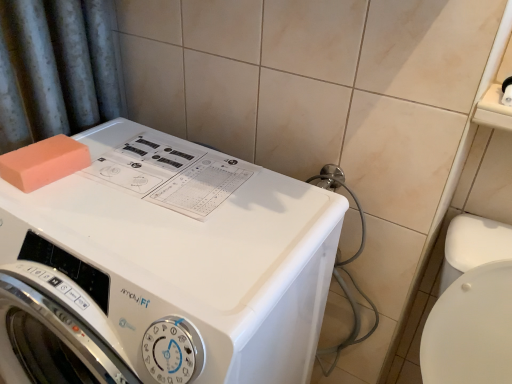
Question: From a real-world perspective, is orange matte sponge at top left located beneath white glossy washing machine at center?

Choices:
 (A) yes
 (B) no

Answer: (B)

Question: From the image's perspective, is orange matte sponge at top left beneath white glossy washing machine at center?

Choices:
 (A) no
 (B) yes

Answer: (A)

Question: From a real-world perspective, is orange matte sponge at top left on top of white glossy washing machine at center?

Choices:
 (A) no
 (B) yes

Answer: (B)

Question: Does orange matte sponge at top left have a lesser height compared to white glossy washing machine at center?

Choices:
 (A) yes
 (B) no

Answer: (A)

Question: Is orange matte sponge at top left with white glossy washing machine at center?

Choices:
 (A) no
 (B) yes

Answer: (A)

Question: Considering the relative sizes of orange matte sponge at top left and white glossy washing machine at center in the image provided, is orange matte sponge at top left smaller than white glossy washing machine at center?

Choices:
 (A) yes
 (B) no

Answer: (A)

Question: Is white glossy washing machine at center oriented towards orange matte sponge at top left?

Choices:
 (A) yes
 (B) no

Answer: (B)

Question: Does white glossy washing machine at center have a lesser width compared to orange matte sponge at top left?

Choices:
 (A) no
 (B) yes

Answer: (A)

Question: Is orange matte sponge at top left at the back of white glossy washing machine at center?

Choices:
 (A) no
 (B) yes

Answer: (A)

Question: Does white glossy washing machine at center come in front of orange matte sponge at top left?

Choices:
 (A) no
 (B) yes

Answer: (B)

Question: From the image's perspective, is white glossy washing machine at center located beneath orange matte sponge at top left?

Choices:
 (A) yes
 (B) no

Answer: (A)

Question: Is white glossy washing machine at center taller than orange matte sponge at top left?

Choices:
 (A) yes
 (B) no

Answer: (A)

Question: In terms of size, does orange matte sponge at top left appear bigger or smaller than white glossy washing machine at center?

Choices:
 (A) big
 (B) small

Answer: (B)